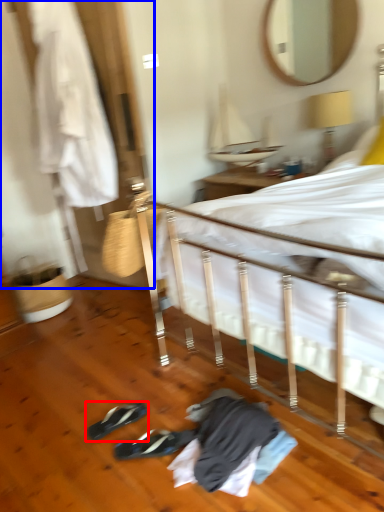
Question: Which point is closer to the camera, footwear (highlighted by a red box) or closet (highlighted by a blue box)?

Choices:
 (A) footwear
 (B) closet

Answer: (A)